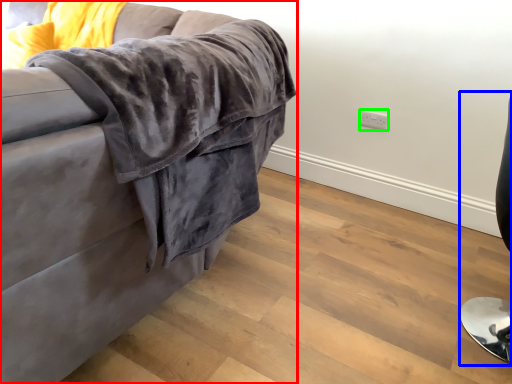
Question: Estimate the real-world distances between objects in this image. Which object is farther from studio couch (highlighted by a red box), computer chair (highlighted by a blue box) or electric outlet (highlighted by a green box)?

Choices:
 (A) computer chair
 (B) electric outlet

Answer: (B)